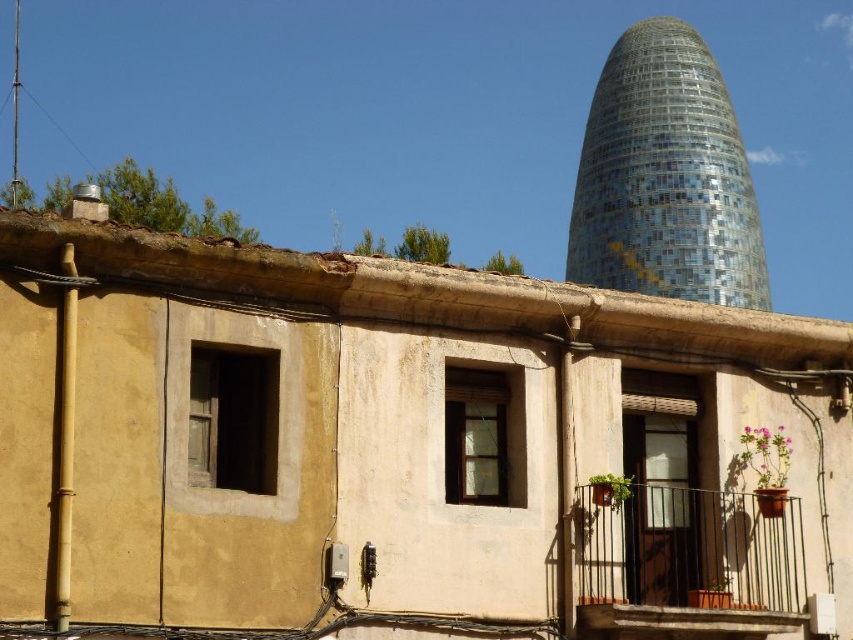
Question: Is blue mosaic tower at upper center above brown wrought iron balcony at lower right?

Choices:
 (A) no
 (B) yes

Answer: (B)

Question: Is blue mosaic tower at upper center further to camera compared to brown wrought iron balcony at lower right?

Choices:
 (A) yes
 (B) no

Answer: (A)

Question: Which point is farther to the camera?

Choices:
 (A) (604, 532)
 (B) (637, 278)

Answer: (B)

Question: Is the position of blue mosaic tower at upper center more distant than that of brown wrought iron balcony at lower right?

Choices:
 (A) yes
 (B) no

Answer: (A)